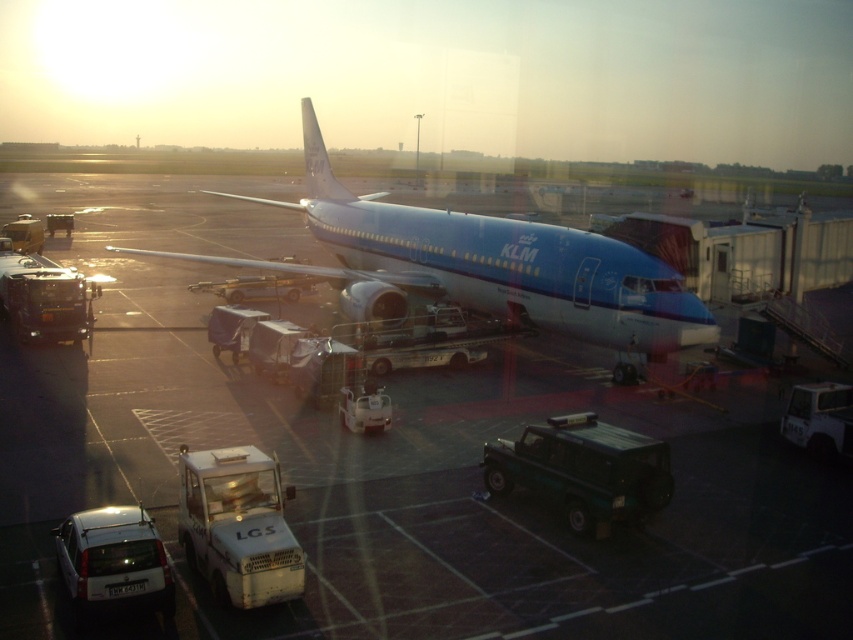
Between point (102, 412) and point (306, 128), which one is positioned in front?

Positioned in front is point (102, 412).

Is blue polished airplane at center below blue glossy airplane at center?

Yes.

Is point (334, 628) closer to camera compared to point (567, 321)?

Yes, it is in front of point (567, 321).

Where is `blue polished airplane at center`? The image size is (853, 640). blue polished airplane at center is located at coordinates (390, 461).